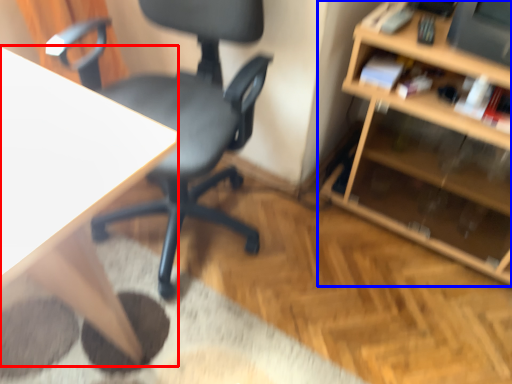
Question: Which point is further to the camera, desk (highlighted by a red box) or shelf (highlighted by a blue box)?

Choices:
 (A) desk
 (B) shelf

Answer: (B)